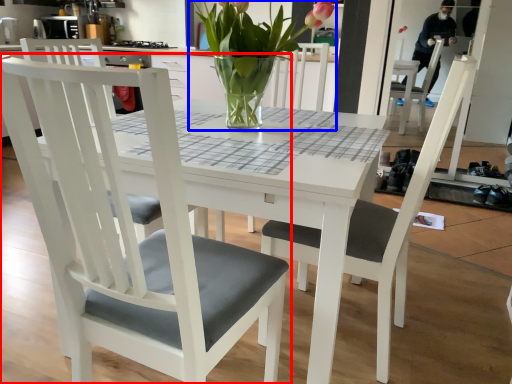
Question: Which of the following is the farthest to the observer, chair (highlighted by a red box) or houseplant (highlighted by a blue box)?

Choices:
 (A) chair
 (B) houseplant

Answer: (B)